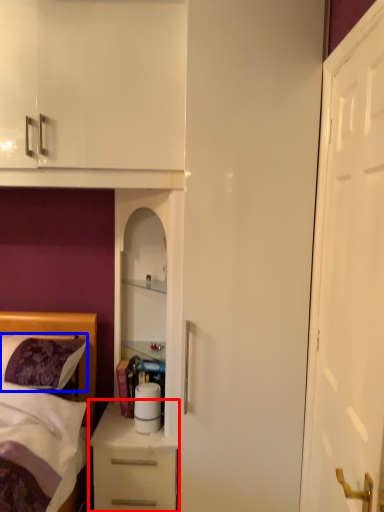
Question: Which of the following is the farthest to the observer, chest of drawers (highlighted by a red box) or pillow (highlighted by a blue box)?

Choices:
 (A) chest of drawers
 (B) pillow

Answer: (A)